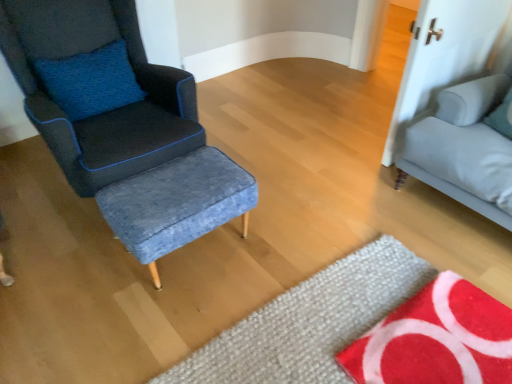
At what (x,y) coordinates should I click in order to perform the action: click on free space above denim fabric stool at center (from a real-world perspective). Please return your answer as a coordinate pair (x, y). This screenshot has height=384, width=512. Looking at the image, I should click on (172, 186).